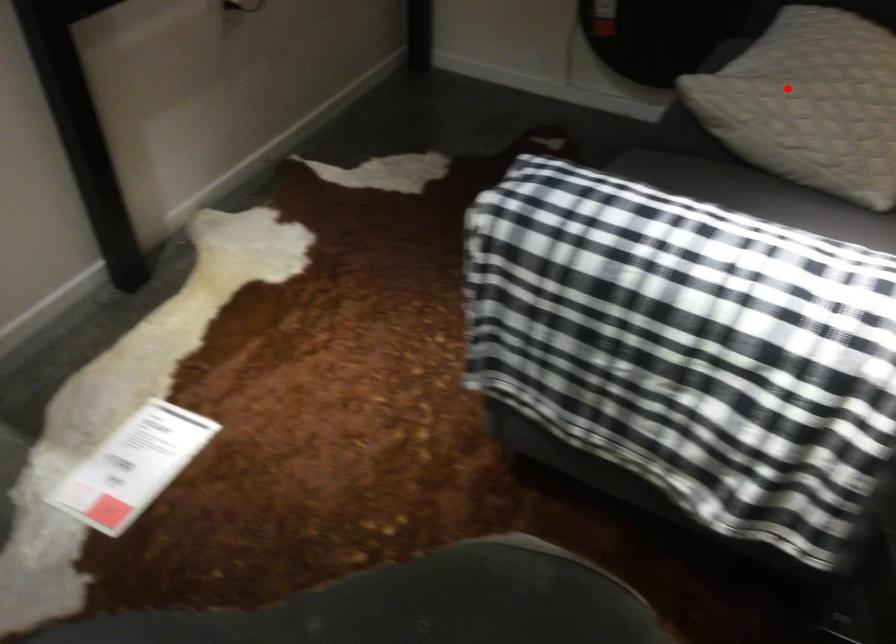
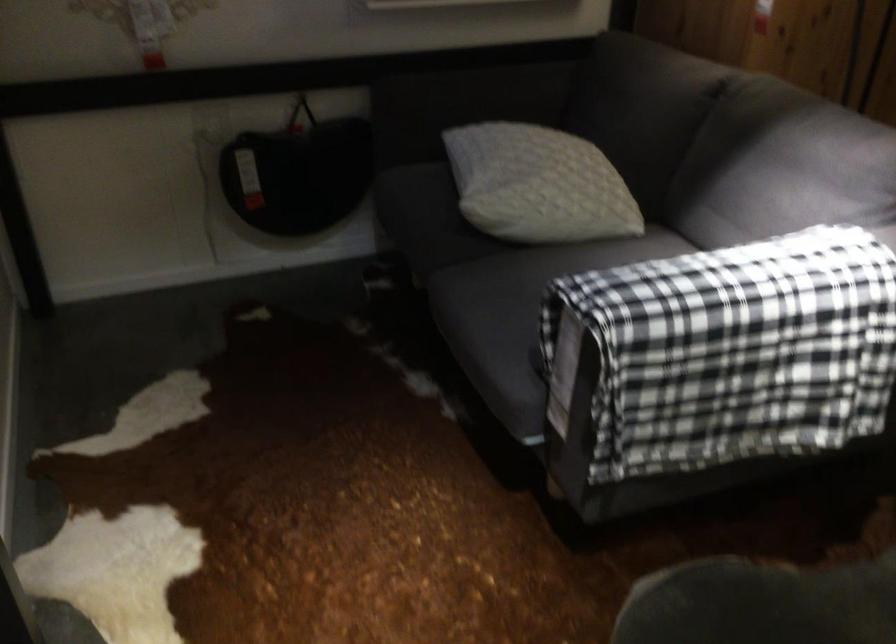
Question: I am providing you with two images of the same scene from different viewpoints. In image1, a red point is highlighted. Considering the same 3D point in image2, which of the following is correct?

Choices:
 (A) It is closer
 (B) It is farther

Answer: (B)